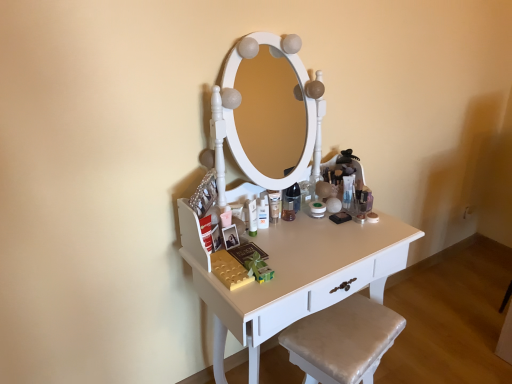
Where is `vacant area that lies in front of matte white lotion at center, which is the first toiletry from left to right`? The image size is (512, 384). vacant area that lies in front of matte white lotion at center, which is the first toiletry from left to right is located at coordinates (265, 260).